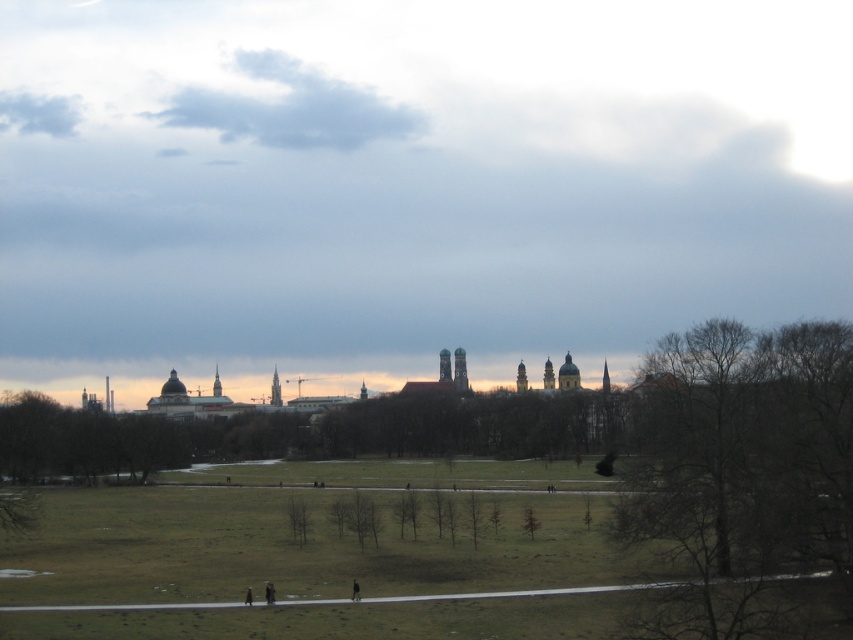
You are standing at the edge of the field in the image and notice a bare wood tree at center and a black fabric person at lower center. Which object is closer to you from your current position?

The black fabric person at lower center is closer to you because the bare wood tree at center is positioned over it, indicating it is further away.

You are an artist setting up your easel to paint the landscape. You have a dark brown leather jacket at lower center and a bare wood tree at center in your view. Which object will appear larger in your painting?

The bare wood tree at center will appear larger in your painting because it is taller than the dark brown leather jacket at lower center.

You are standing at the starting point of the pathway in the open field and want to walk directly towards the cluster of historic buildings on the horizon. Will the bare wood tree at center obstruct your path?

The bare wood tree at center is located at point (740,468), which is not along the direct path towards the historic buildings on the horizon, so it will not obstruct your path.